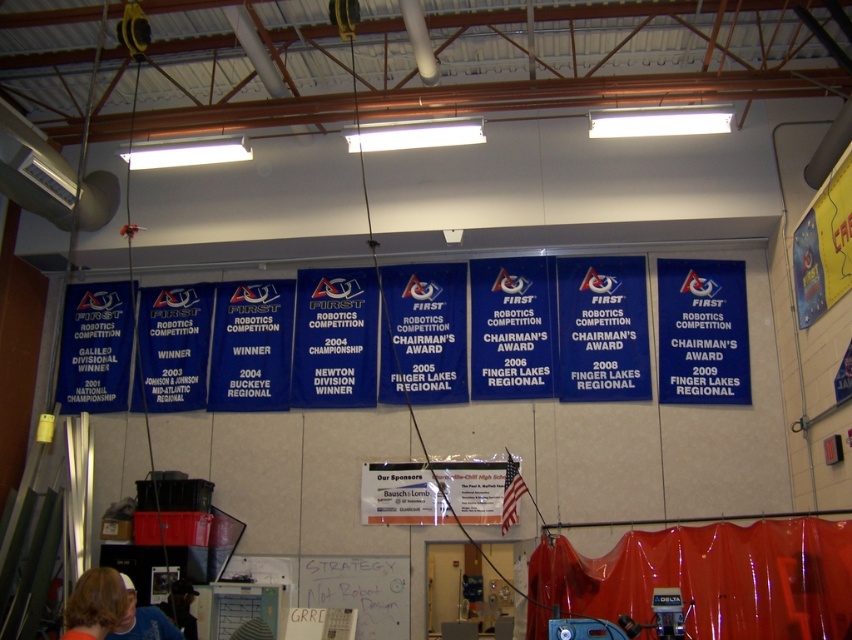
Question: Which of the following is the farthest from the observer?

Choices:
 (A) (188, 632)
 (B) (448, 464)

Answer: (B)

Question: Does blue fabric banner at center-right appear on the right side of white paper at center?

Choices:
 (A) no
 (B) yes

Answer: (B)

Question: Is blue fabric banner at center-right further to camera compared to white paper at center?

Choices:
 (A) no
 (B) yes

Answer: (B)

Question: Can you confirm if blue fabric banner at center-right is positioned above blonde hair at lower left?

Choices:
 (A) no
 (B) yes

Answer: (B)

Question: Among these points, which one is nearest to the camera?

Choices:
 (A) (404, 481)
 (B) (135, 592)
 (C) (176, 593)

Answer: (B)

Question: Estimate the real-world distances between objects in this image. Which object is farther from the white paper at center?

Choices:
 (A) blue t-shirt at lower left
 (B) blonde hair at lower left

Answer: (B)